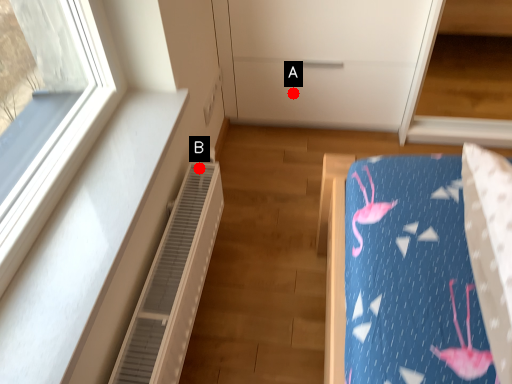
Question: Two points are circled on the image, labeled by A and B beside each circle. Among these points, which one is nearest to the camera?

Choices:
 (A) A is closer
 (B) B is closer

Answer: (B)